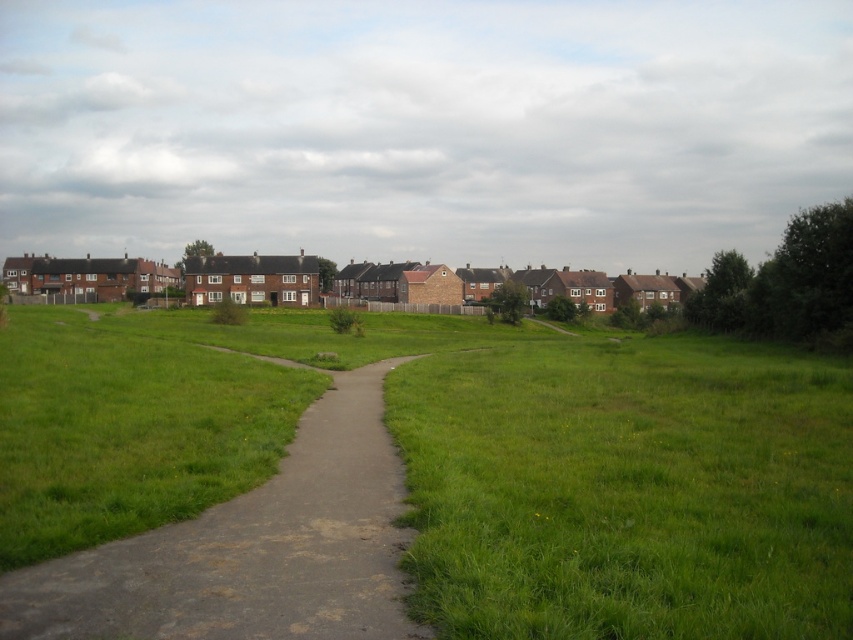
You are a gardener who needs to mow the lawn. You are standing on the green grass at center and want to reach the dull gray concrete path at center to get your gardening tools. Can you walk directly to the path without crossing any obstacles?

The green grass at center and dull gray concrete path at center are 15.77 meters apart from each other. Since there are no obstacles mentioned between them in the scene description, you can walk directly to the path.

You are standing at the edge of the suburban scene and want to walk towards the brick houses in the midground. Which object, the green grass at center or the dull gray concrete path at center, will you step on first?

The green grass at center is closer to the viewer than the dull gray concrete path at center, so you will step on the green grass at center first before reaching the path.